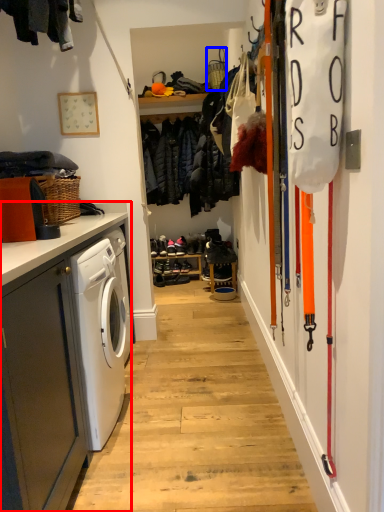
Question: Which point is closer to the camera, cabinetry (highlighted by a red box) or basket (highlighted by a blue box)?

Choices:
 (A) cabinetry
 (B) basket

Answer: (A)